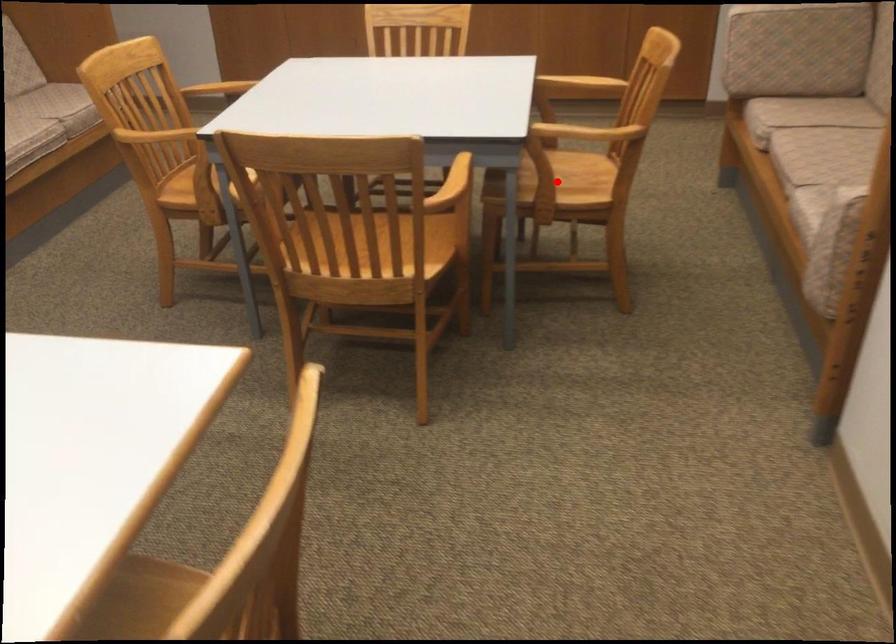
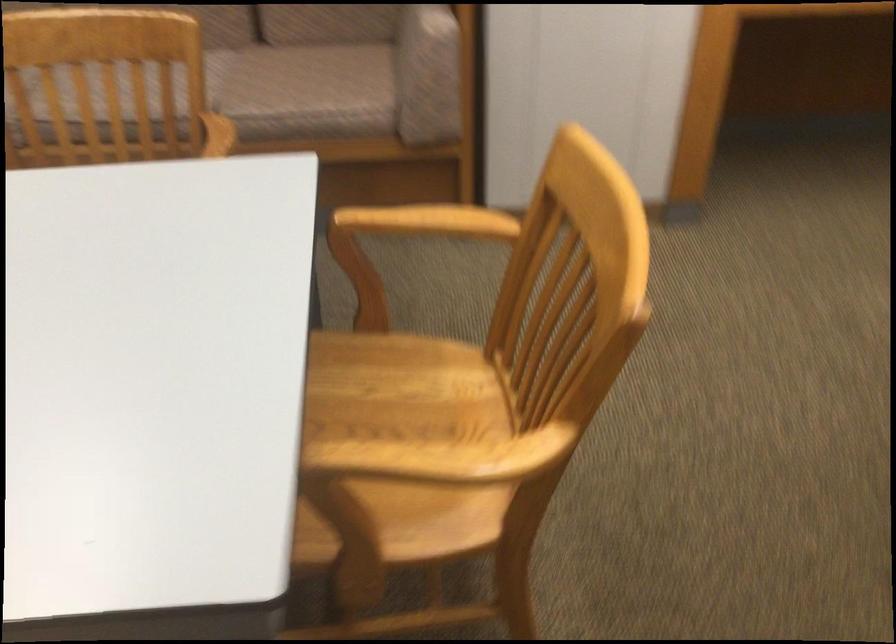
Question: I am providing you with two images of the same scene from different viewpoints. A red point is marked on the first image. Can you still see the location of the red point in image 2?

Choices:
 (A) Yes
 (B) No

Answer: (B)